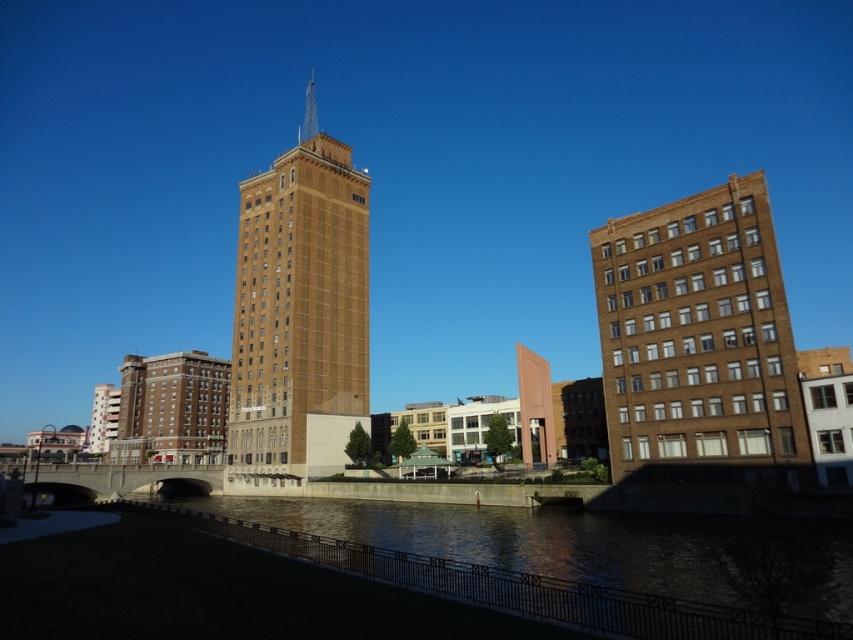
Which is more to the left, brown brick tower at center or brown concrete river at lower center?

From the viewer's perspective, brown brick tower at center appears more on the left side.

Who is more forward, (286, 412) or (740, 627)?

Positioned in front is point (740, 627).

Where is `brown brick tower at center`? Image resolution: width=853 pixels, height=640 pixels. brown brick tower at center is located at coordinates (300, 308).

Is brown brick building at right taller than brown brick tower at center?

No.

Who is positioned more to the right, brown brick building at right or brown brick tower at center?

From the viewer's perspective, brown brick building at right appears more on the right side.

Describe the element at coordinates (698, 340) in the screenshot. I see `brown brick building at right` at that location.

Find the location of `brown brick building at right`. brown brick building at right is located at coordinates (698, 340).

Which is below, brown brick building at right or brown concrete river at lower center?

brown concrete river at lower center is below.

Which is above, brown brick building at right or brown concrete river at lower center?

brown brick building at right is above.

Find the location of `brown brick building at right`. brown brick building at right is located at coordinates (698, 340).